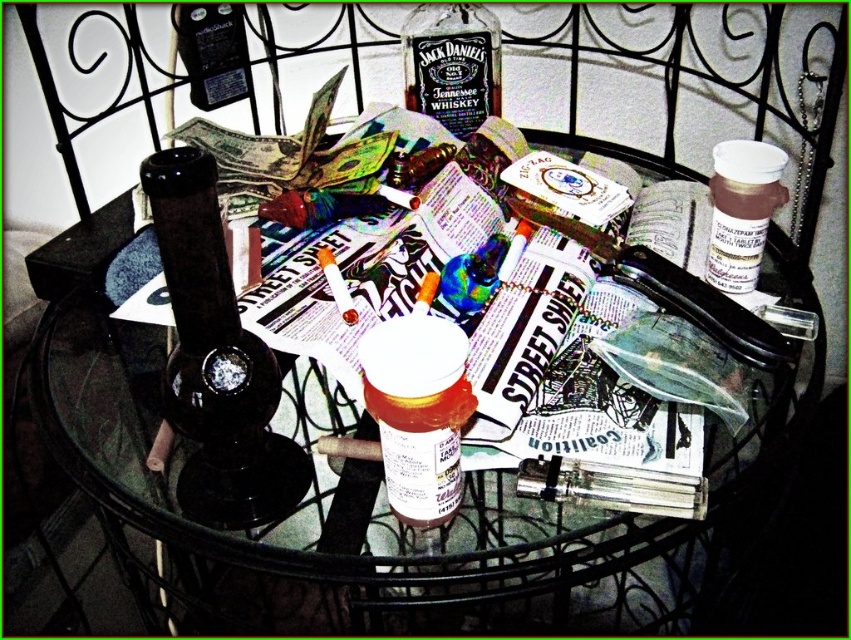
You are a delivery person who needs to place a new item on the table without moving any existing items. The item you are delivering is 14 inches wide. Can you fit it between the translucent plastic pill bottle at center and the white plastic container at upper right?

The distance between the translucent plastic pill bottle at center and the white plastic container at upper right is 13.74 inches. Since the item you want to place is 14 inches wide, it is slightly wider than the available space. Therefore, it won

Looking at this image, you are organizing the items on the table and need to place the matte black bottle at upper center somewhere. Where is the black glass bong at center located in relation to it?

The black glass bong at center is positioned under the matte black bottle at upper center.